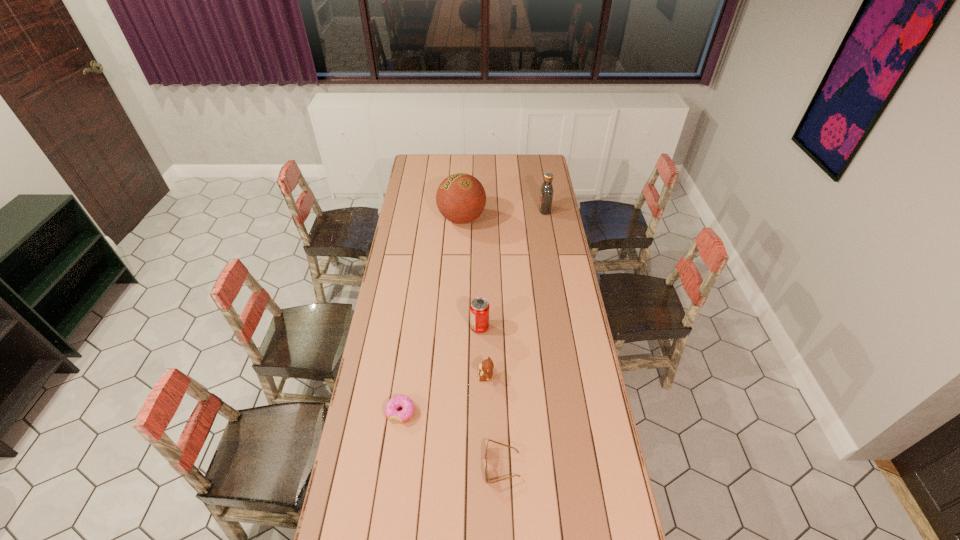
At what (x,y) coordinates should I click in order to perform the action: click on basketball. Please return your answer as a coordinate pair (x, y). The width and height of the screenshot is (960, 540). Looking at the image, I should click on (461, 198).

At what (x,y) coordinates should I click in order to perform the action: click on the fifth shortest object. Please return your answer as a coordinate pair (x, y). Image resolution: width=960 pixels, height=540 pixels. Looking at the image, I should click on (546, 193).

This screenshot has height=540, width=960. In order to click on vodka in this screenshot , I will do `click(546, 193)`.

Find the location of a particular element. This screenshot has width=960, height=540. the third farthest object is located at coordinates click(479, 307).

At what (x,y) coordinates should I click in order to perform the action: click on soda can. Please return your answer as a coordinate pair (x, y). The height and width of the screenshot is (540, 960). Looking at the image, I should click on (479, 307).

Find the location of a particular element. The image size is (960, 540). teddy bear is located at coordinates (486, 367).

You are a GUI agent. You are given a task and a screenshot of the screen. Output one action in this format:
    pyautogui.click(x=<x>, y=<y>)
    Task: Click on the third shortest object
    This screenshot has width=960, height=540.
    Given the screenshot: What is the action you would take?
    pyautogui.click(x=486, y=367)

Image resolution: width=960 pixels, height=540 pixels. I want to click on doughnut, so click(x=399, y=401).

Where is `the second nearest object`? the second nearest object is located at coordinates (399, 401).

Find the location of `the nearest object`. the nearest object is located at coordinates (486, 471).